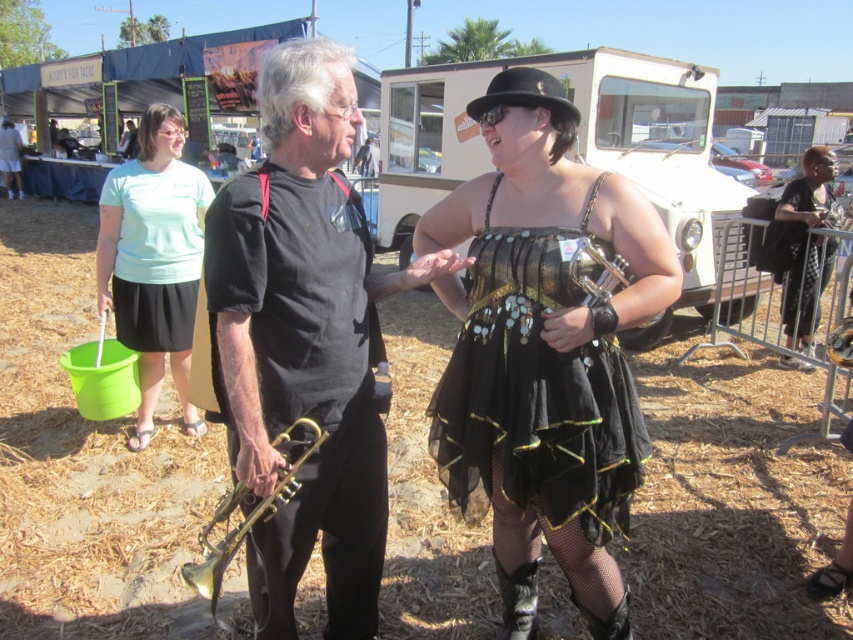
Based on the photo, does shiny gold trumpet at center have a greater width compared to gold brass trumpet at center?

Yes, shiny gold trumpet at center is wider than gold brass trumpet at center.

Is shiny gold trumpet at center to the left of gold brass trumpet at center from the viewer's perspective?

Incorrect, shiny gold trumpet at center is not on the left side of gold brass trumpet at center.

Does point (563, 534) lie behind point (316, 276)?

That is True.

Locate an element on the screen. shiny gold trumpet at center is located at coordinates (541, 348).

Which is above, gold brass trumpet at center or gold shiny trumpet at center?

gold brass trumpet at center

Is point (270, 344) farther from camera compared to point (227, 547)?

No.

Locate an element on the screen. This screenshot has width=853, height=640. gold brass trumpet at center is located at coordinates pos(305,340).

Can you confirm if black sequined dress at center is positioned below light blue cotton shirt at upper left?

Yes, black sequined dress at center is below light blue cotton shirt at upper left.

Which is above, black sequined dress at center or light blue cotton shirt at upper left?

light blue cotton shirt at upper left

Locate an element on the screen. black sequined dress at center is located at coordinates (544, 349).